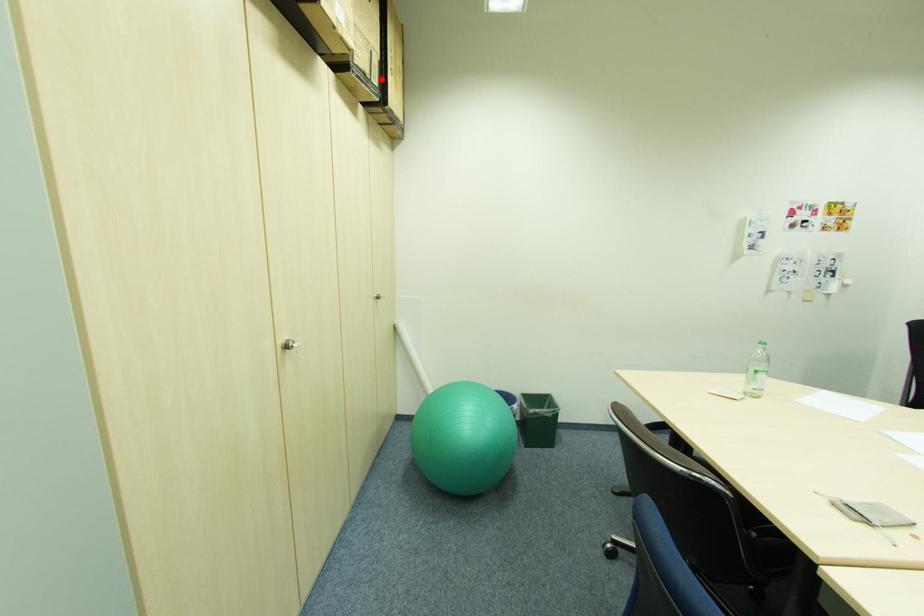
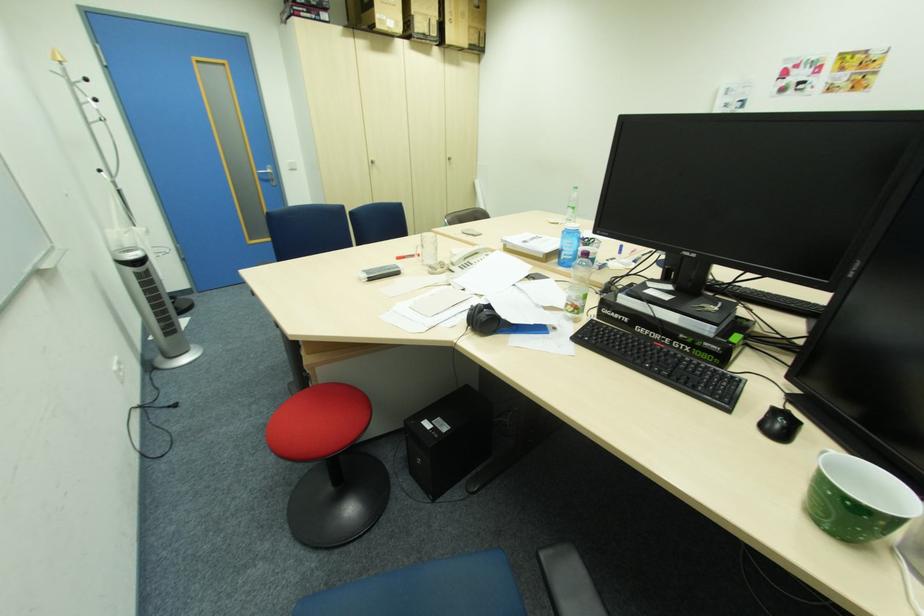
In the second image, find the point that corresponds to the highlighted location in the first image.

(441, 31)